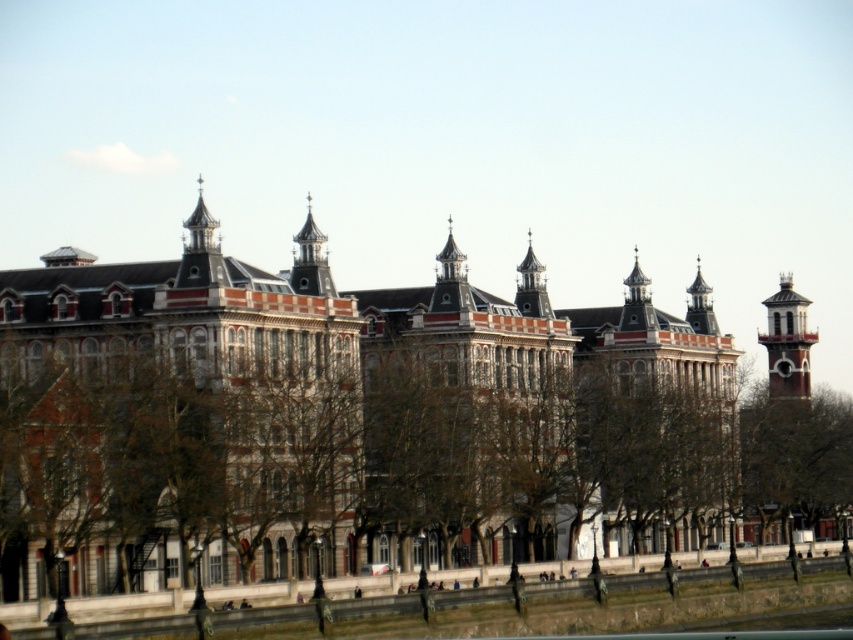
Is point (659, 513) less distant than point (770, 336)?

That is True.

In the scene shown: Which is above, brown leafless tree at center or red brick clock tower at right?

red brick clock tower at right is higher up.

This screenshot has height=640, width=853. Describe the element at coordinates (386, 468) in the screenshot. I see `brown leafless tree at center` at that location.

This screenshot has height=640, width=853. Identify the location of brown leafless tree at center. (386, 468).

This screenshot has width=853, height=640. What do you see at coordinates (310, 260) in the screenshot? I see `smooth gray steeple at center` at bounding box center [310, 260].

Which of these two, smooth gray steeple at center or polished brass clock tower at upper right, stands taller?

With more height is smooth gray steeple at center.

Does point (320, 230) come in front of point (701, 324)?

Yes, point (320, 230) is in front of point (701, 324).

Find the location of a particular element. The height and width of the screenshot is (640, 853). smooth gray steeple at center is located at coordinates (310, 260).

Is gray stone tower at center in front of polished brass clock tower at upper right?

Yes, it is in front of polished brass clock tower at upper right.

Does gray stone tower at center appear over polished brass clock tower at upper right?

Yes.

Is point (540, 301) positioned after point (694, 300)?

No, it is not.

The width and height of the screenshot is (853, 640). Identify the location of gray stone tower at center. (531, 285).